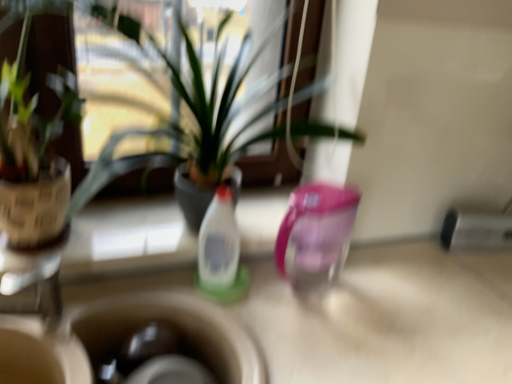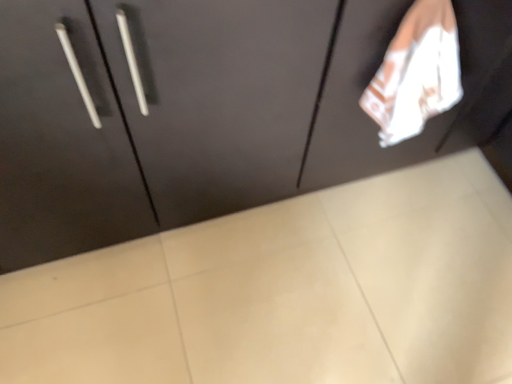
Question: How did the camera likely rotate when shooting the video?

Choices:
 (A) rotated upward
 (B) rotated downward

Answer: (B)